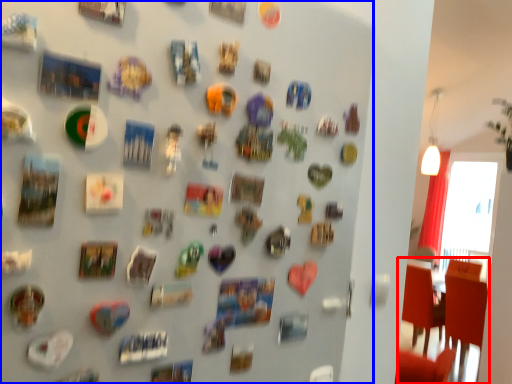
Question: Among these objects, which one is farthest to the camera, chair (highlighted by a red box) or collection (highlighted by a blue box)?

Choices:
 (A) chair
 (B) collection

Answer: (A)